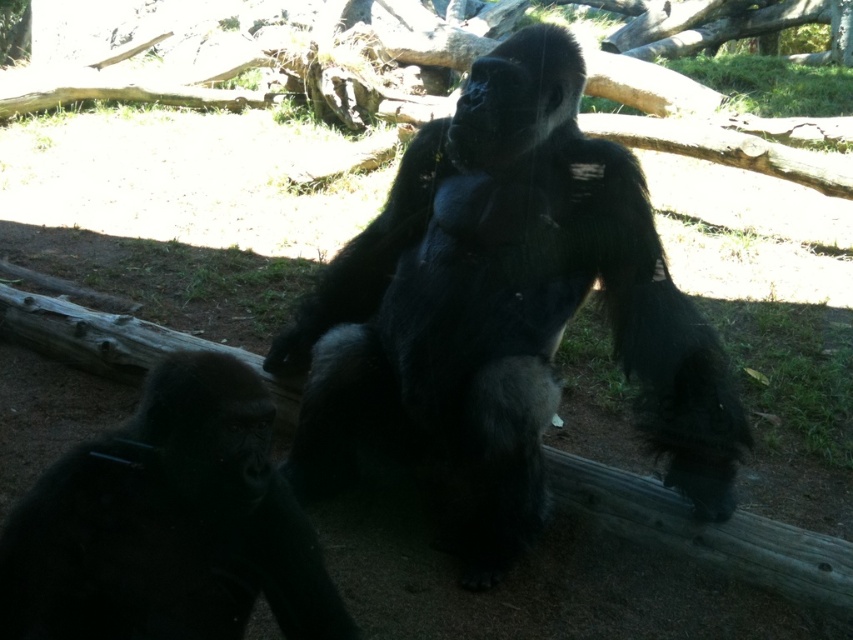
Is shiny black gorilla at center above black matte gorilla at lower left?

Yes, shiny black gorilla at center is above black matte gorilla at lower left.

Find the location of a particular element. The height and width of the screenshot is (640, 853). shiny black gorilla at center is located at coordinates (503, 310).